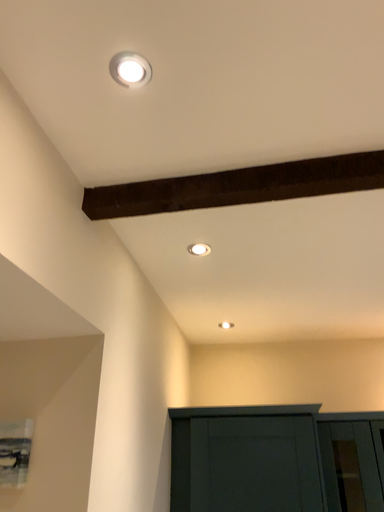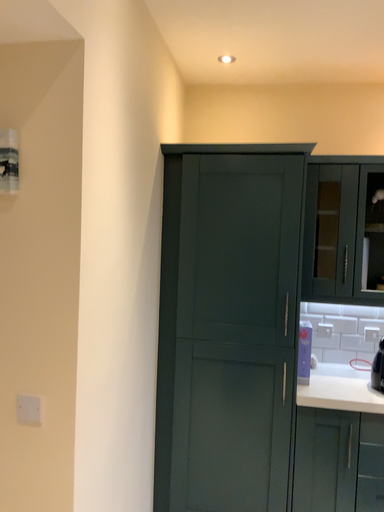
Question: How did the camera likely rotate when shooting the video?

Choices:
 (A) rotated downward
 (B) rotated upward

Answer: (A)